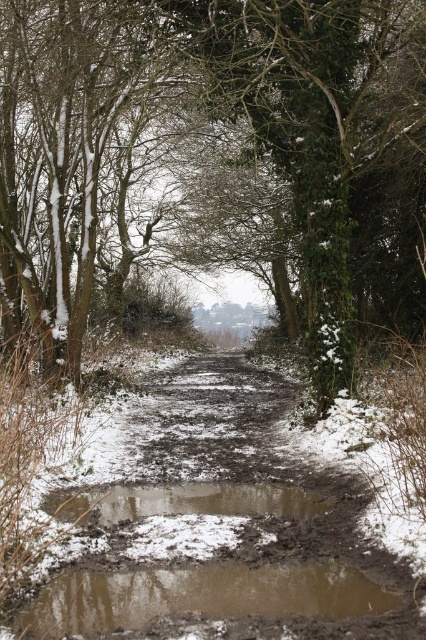
Between muddy wet path at center and brown muddy puddle at center, which one appears on the left side from the viewer's perspective?

brown muddy puddle at center

Is muddy wet path at center above brown muddy puddle at center?

Correct, muddy wet path at center is located above brown muddy puddle at center.

Is point (92, 477) positioned after point (316, 509)?

Yes, it is.

Find the location of a particular element. muddy wet path at center is located at coordinates (219, 525).